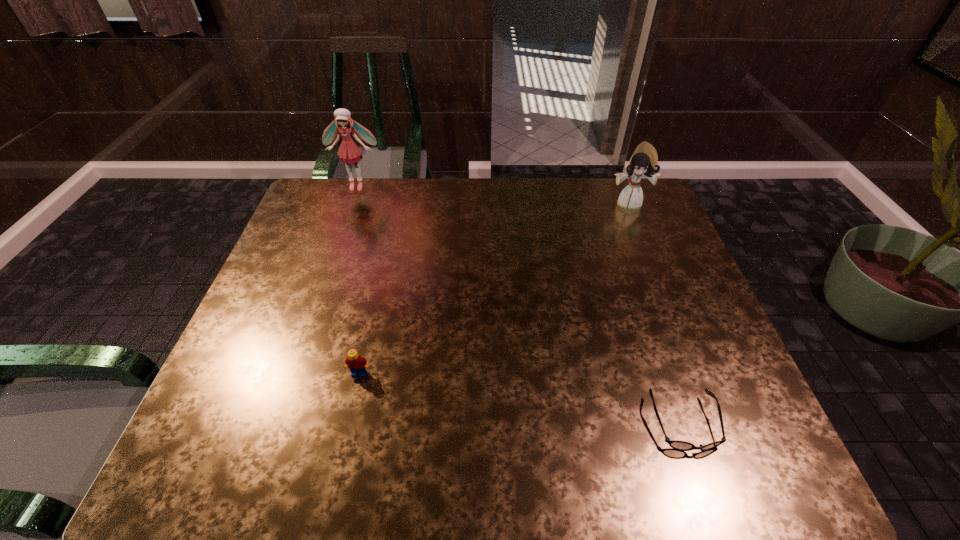
This screenshot has height=540, width=960. In order to click on vacant region located on the front-facing side of the second object from left to right in this screenshot , I will do `click(348, 420)`.

Where is `object that is at the near edge`? The height and width of the screenshot is (540, 960). object that is at the near edge is located at coordinates (675, 444).

What are the coordinates of `object that is at the left edge` in the screenshot? It's located at (349, 152).

Where is `doll positioned at the right edge`? doll positioned at the right edge is located at coordinates (643, 163).

Find the location of `sunglasses located at the right edge`. sunglasses located at the right edge is located at coordinates (675, 444).

I want to click on object situated at the far left corner, so click(x=349, y=152).

The width and height of the screenshot is (960, 540). Find the location of `object that is at the far right corner`. object that is at the far right corner is located at coordinates (643, 163).

I want to click on object located at the near right corner, so click(x=675, y=444).

Identify the location of free space at the far edge of the desktop. The height and width of the screenshot is (540, 960). (573, 213).

I want to click on vacant position at the near edge of the desktop, so click(505, 448).